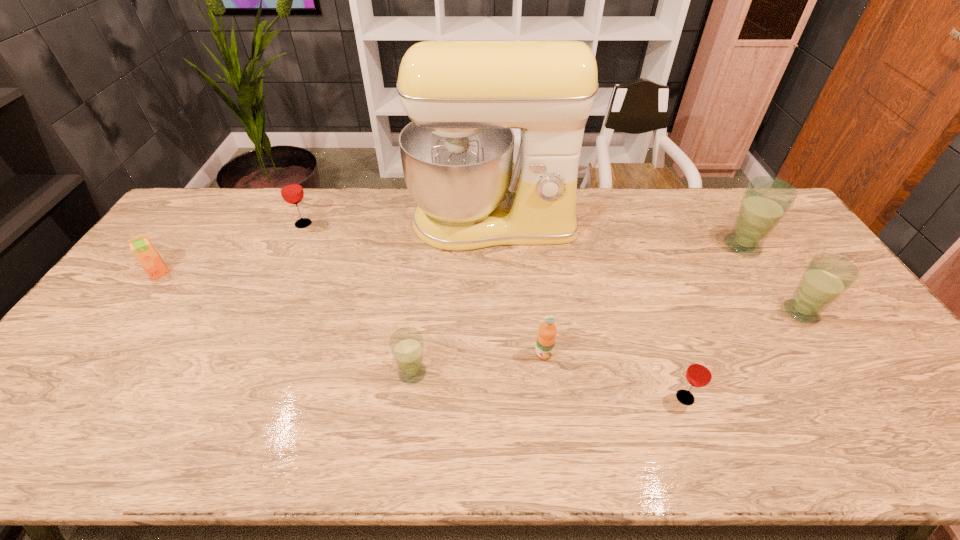
This screenshot has height=540, width=960. Find the location of `free space between the smaller red glass and the fourth farthest object`. free space between the smaller red glass and the fourth farthest object is located at coordinates (422, 335).

Locate an element on the screen. This screenshot has height=540, width=960. free space between the nearest blue glass and the right orange juice is located at coordinates (478, 363).

This screenshot has height=540, width=960. Identify the location of blank region between the left red glass and the third nearest glass. (552, 268).

Locate an element on the screen. This screenshot has width=960, height=540. vacant area that lies between the third nearest glass and the fourth glass from right to left is located at coordinates (607, 342).

Locate an element on the screen. The image size is (960, 540). free spot between the right orange juice and the fourth glass from right to left is located at coordinates (478, 363).

Where is `vacant space in between the second smallest blue glass and the right red glass`? The height and width of the screenshot is (540, 960). vacant space in between the second smallest blue glass and the right red glass is located at coordinates (743, 355).

Where is `vacant area that lies between the left orange juice and the right orange juice`? The width and height of the screenshot is (960, 540). vacant area that lies between the left orange juice and the right orange juice is located at coordinates (351, 313).

Find the location of a particular element. free spot between the left red glass and the third nearest glass is located at coordinates (552, 268).

Locate which object ranks fifth in proximity to the fourth nearest object. Please provide its 2D coordinates. Your answer should be formatted as a tuple, i.e. [(x, y)], where the tuple contains the x and y coordinates of a point satisfying the conditions above.

[(407, 345)]

Identify which object is the fourth nearest to the smaller red glass. Please provide its 2D coordinates. Your answer should be formatted as a tuple, i.e. [(x, y)], where the tuple contains the x and y coordinates of a point satisfying the conditions above.

[(766, 200)]